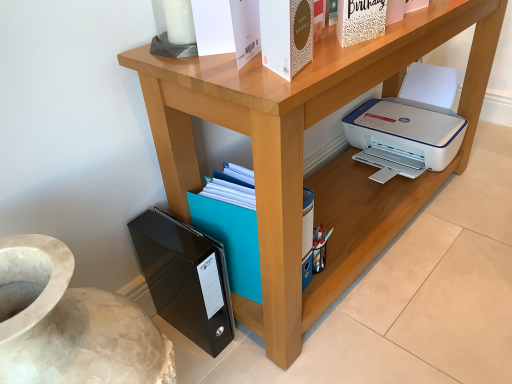
This screenshot has height=384, width=512. Describe the element at coordinates (302, 150) in the screenshot. I see `wooden printer at lower right` at that location.

Image resolution: width=512 pixels, height=384 pixels. Describe the element at coordinates (185, 278) in the screenshot. I see `black glossy file folder at lower left, which ranks as the 1th paperback book in back-to-front order` at that location.

At what (x,y) coordinates should I click in order to perform the action: click on white textured paper at upper center, the second paperback book in the back-to-front sequence. Please return your answer as a coordinate pair (x, y). This screenshot has width=512, height=384. Looking at the image, I should click on (360, 20).

Between point (384, 33) and point (342, 241), which one is positioned in front?

Point (384, 33)

How many degrees apart are the facing directions of white textured paper at upper center, which is counted as the 3th paperback book, starting from the bottom, and wooden printer at lower right?

The angle between the facing direction of white textured paper at upper center, which is counted as the 3th paperback book, starting from the bottom, and the facing direction of wooden printer at lower right is 13.6 degrees.

Can you confirm if white textured paper at upper center, which ranks as the 3th paperback book in left-to-right order, is wider than wooden printer at lower right?

Incorrect, the width of white textured paper at upper center, which ranks as the 3th paperback book in left-to-right order, does not surpass that of wooden printer at lower right.

What are the coordinates of `desk below the white textured paper at upper center, the second paperback book in the back-to-front sequence (from the image's perspective)` in the screenshot? It's located at (302, 150).

Is white textured paper at upper center, which ranks as the 3th paperback book in left-to-right order, inside black glossy file folder at lower left, which appears as the first paperback book when viewed from the left?

No, black glossy file folder at lower left, which appears as the first paperback book when viewed from the left, does not contain white textured paper at upper center, which ranks as the 3th paperback book in left-to-right order.

Does black glossy file folder at lower left, the first paperback book in the bottom-to-top sequence, have a greater height compared to white textured paper at upper center, which ranks as the 3th paperback book in left-to-right order?

Yes, black glossy file folder at lower left, the first paperback book in the bottom-to-top sequence, is taller than white textured paper at upper center, which ranks as the 3th paperback book in left-to-right order.

In the scene shown: Considering the sizes of objects black glossy file folder at lower left, which is the third paperback book in front-to-back order, and white textured paper at upper center, which ranks as the 3th paperback book in left-to-right order, in the image provided, who is wider, black glossy file folder at lower left, which is the third paperback book in front-to-back order, or white textured paper at upper center, which ranks as the 3th paperback book in left-to-right order,?

black glossy file folder at lower left, which is the third paperback book in front-to-back order, is wider.

Is black glossy file folder at lower left, the third paperback book viewed from the right, smaller than white textured paper at upper center, which ranks as the 3th paperback book in left-to-right order?

No.

In the scene shown: Is wooden printer at lower right at the left side of black glossy file folder at lower left, the first paperback book in the bottom-to-top sequence?

No, wooden printer at lower right is not to the left of black glossy file folder at lower left, the first paperback book in the bottom-to-top sequence.

This screenshot has height=384, width=512. Identify the location of desk located above the black glossy file folder at lower left, which ranks as the 1th paperback book in back-to-front order (from the image's perspective). (302, 150).

Looking at this image, is wooden printer at lower right in front of or behind black glossy file folder at lower left, the third paperback book viewed from the right, in the image?

Clearly, wooden printer at lower right is in front of black glossy file folder at lower left, the third paperback book viewed from the right.

Is wooden printer at lower right not inside black glossy file folder at lower left, the third paperback book viewed from the right?

Yes, wooden printer at lower right is outside of black glossy file folder at lower left, the third paperback book viewed from the right.

Does gold textured paper at upper center, the second paperback book viewed from the right, have a lesser width compared to white textured paper at upper center, the 1th paperback book in the right-to-left sequence?

Yes.

Which is correct: gold textured paper at upper center, placed as the 1th paperback book when sorted from front to back, is inside white textured paper at upper center, which is counted as the 3th paperback book, starting from the bottom, or outside of it?

gold textured paper at upper center, placed as the 1th paperback book when sorted from front to back, is outside white textured paper at upper center, which is counted as the 3th paperback book, starting from the bottom.

This screenshot has height=384, width=512. In order to click on paperback book to the right of gold textured paper at upper center, the 2th paperback book from the bottom in this screenshot , I will do `click(360, 20)`.

Considering their positions, is gold textured paper at upper center, which ranks as the 2th paperback book in top-to-bottom order, located in front of or behind white textured paper at upper center, the 1th paperback book in the right-to-left sequence?

Visually, gold textured paper at upper center, which ranks as the 2th paperback book in top-to-bottom order, is located in front of white textured paper at upper center, the 1th paperback book in the right-to-left sequence.

Considering the relative sizes of wooden printer at lower right and gold textured paper at upper center, the 2th paperback book from the bottom, in the image provided, is wooden printer at lower right taller than gold textured paper at upper center, the 2th paperback book from the bottom,?

Yes, wooden printer at lower right is taller than gold textured paper at upper center, the 2th paperback book from the bottom.

Can you tell me how much wooden printer at lower right and gold textured paper at upper center, which appears as the 2th paperback book when viewed from the left, differ in facing direction?

The facing directions of wooden printer at lower right and gold textured paper at upper center, which appears as the 2th paperback book when viewed from the left, are 15.8 degrees apart.

Does wooden printer at lower right have a greater width compared to gold textured paper at upper center, the 2th paperback book from the bottom?

Correct, the width of wooden printer at lower right exceeds that of gold textured paper at upper center, the 2th paperback book from the bottom.

Is point (361, 19) positioned behind point (150, 242)?

No, (361, 19) is in front of (150, 242).

Can you confirm if white textured paper at upper center, which ranks as the 3th paperback book in left-to-right order, is shorter than black glossy file folder at lower left, the first paperback book in the bottom-to-top sequence?

Correct, white textured paper at upper center, which ranks as the 3th paperback book in left-to-right order, is not as tall as black glossy file folder at lower left, the first paperback book in the bottom-to-top sequence.

Can you confirm if white textured paper at upper center, the 1th paperback book in the right-to-left sequence, is positioned to the right of black glossy file folder at lower left, which appears as the 3th paperback book when viewed from the top?

Correct, you'll find white textured paper at upper center, the 1th paperback book in the right-to-left sequence, to the right of black glossy file folder at lower left, which appears as the 3th paperback book when viewed from the top.

Would you say black glossy file folder at lower left, which appears as the first paperback book when viewed from the left, is part of white textured paper at upper center, the second paperback book in the back-to-front sequence,'s contents?

Definitely not — black glossy file folder at lower left, which appears as the first paperback book when viewed from the left, is not inside white textured paper at upper center, the second paperback book in the back-to-front sequence.

In terms of width, does gold textured paper at upper center, the 2th paperback book from the bottom, look wider or thinner when compared to wooden printer at lower right?

In the image, gold textured paper at upper center, the 2th paperback book from the bottom, appears to be more narrow than wooden printer at lower right.

Between gold textured paper at upper center, arranged as the third paperback book when viewed from the back, and wooden printer at lower right, which one is positioned in front?

wooden printer at lower right.

At what (x,y) coordinates should I click in order to perform the action: click on the 1st paperback book behind the wooden printer at lower right. Please return your answer as a coordinate pair (x, y). Looking at the image, I should click on (286, 35).

Is gold textured paper at upper center, which appears as the 2th paperback book when viewed from the left, in contact with wooden printer at lower right?

No, gold textured paper at upper center, which appears as the 2th paperback book when viewed from the left, is not in contact with wooden printer at lower right.

Locate an element on the screen. The height and width of the screenshot is (384, 512). desk in front of the white textured paper at upper center, marked as the 1th paperback book in a top-to-bottom arrangement is located at coordinates (302, 150).

From the black glossy file folder at lower left, which ranks as the 1th paperback book in back-to-front order, count 2nd paperback book to the right and point to it. Please provide its 2D coordinates.

[(360, 20)]

Estimate the real-world distances between objects in this image. Which object is further from wooden printer at lower right, gold textured paper at upper center, the second paperback book viewed from the right, or white textured paper at upper center, which ranks as the 3th paperback book in left-to-right order?

The object further to wooden printer at lower right is white textured paper at upper center, which ranks as the 3th paperback book in left-to-right order.

Consider the image. When comparing their distances from white textured paper at upper center, the second paperback book in the back-to-front sequence, does black glossy file folder at lower left, the first paperback book in the bottom-to-top sequence, or wooden printer at lower right seem further?

black glossy file folder at lower left, the first paperback book in the bottom-to-top sequence, is further to white textured paper at upper center, the second paperback book in the back-to-front sequence.

When comparing their distances from wooden printer at lower right, does gold textured paper at upper center, the 2th paperback book from the bottom, or black glossy file folder at lower left, which appears as the first paperback book when viewed from the left, seem closer?

The object closer to wooden printer at lower right is black glossy file folder at lower left, which appears as the first paperback book when viewed from the left.

When comparing their distances from gold textured paper at upper center, arranged as the third paperback book when viewed from the back, does wooden printer at lower right or white textured paper at upper center, which ranks as the 3th paperback book in left-to-right order, seem closer?

white textured paper at upper center, which ranks as the 3th paperback book in left-to-right order, is positioned closer to the anchor gold textured paper at upper center, arranged as the third paperback book when viewed from the back.

Considering their positions, is wooden printer at lower right positioned closer to white textured paper at upper center, which ranks as the 3th paperback book in left-to-right order, than black glossy file folder at lower left, which ranks as the 1th paperback book in back-to-front order?

Based on the image, wooden printer at lower right appears to be nearer to white textured paper at upper center, which ranks as the 3th paperback book in left-to-right order.

When comparing their distances from white textured paper at upper center, the second paperback book viewed from the front, does black glossy file folder at lower left, which is the third paperback book in front-to-back order, or gold textured paper at upper center, the second paperback book viewed from the right, seem further?

Among the two, black glossy file folder at lower left, which is the third paperback book in front-to-back order, is located further to white textured paper at upper center, the second paperback book viewed from the front.

Considering their positions, is black glossy file folder at lower left, which ranks as the 1th paperback book in back-to-front order, positioned closer to gold textured paper at upper center, arranged as the third paperback book when viewed from the back, than wooden printer at lower right?

wooden printer at lower right lies closer to gold textured paper at upper center, arranged as the third paperback book when viewed from the back, than the other object.

Based on their spatial positions, is wooden printer at lower right or black glossy file folder at lower left, which appears as the first paperback book when viewed from the left, further from gold textured paper at upper center, which ranks as the 2th paperback book in top-to-bottom order?

black glossy file folder at lower left, which appears as the first paperback book when viewed from the left, lies further to gold textured paper at upper center, which ranks as the 2th paperback book in top-to-bottom order, than the other object.

I want to click on paperback book that lies between white textured paper at upper center, the 1th paperback book in the right-to-left sequence, and black glossy file folder at lower left, which ranks as the 1th paperback book in back-to-front order, from top to bottom, so click(x=286, y=35).

Find the location of a particular element. The height and width of the screenshot is (384, 512). paperback book between gold textured paper at upper center, arranged as the third paperback book when viewed from the back, and wooden printer at lower right is located at coordinates (360, 20).

I want to click on desk between white textured paper at upper center, the second paperback book viewed from the front, and black glossy file folder at lower left, the third paperback book viewed from the right, from top to bottom, so click(x=302, y=150).

Locate an element on the screen. The width and height of the screenshot is (512, 384). desk between gold textured paper at upper center, the second paperback book viewed from the right, and black glossy file folder at lower left, the third paperback book viewed from the right, from top to bottom is located at coordinates (302, 150).